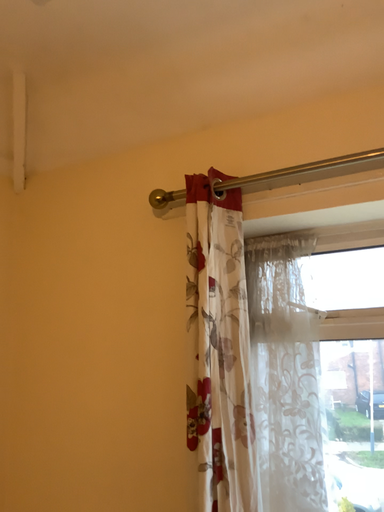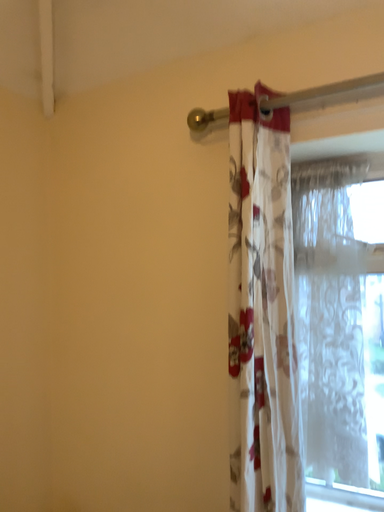
Question: How did the camera likely rotate when shooting the video?

Choices:
 (A) rotated upward
 (B) rotated downward

Answer: (B)